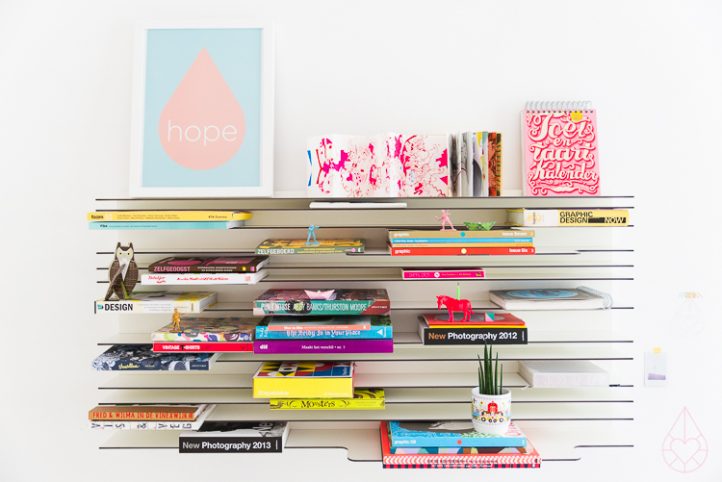
Identify the location of decorations. The width and height of the screenshot is (722, 482). (193, 117), (388, 157), (118, 272), (180, 321), (500, 407), (456, 306), (313, 233), (443, 219), (482, 226).